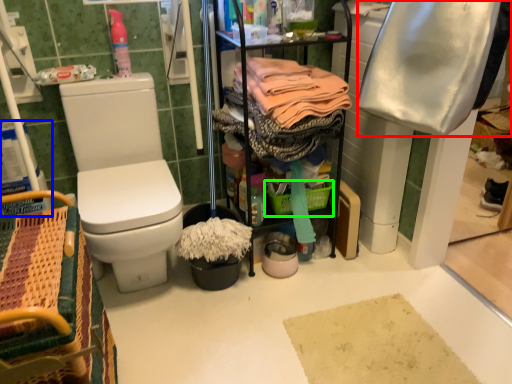
Question: Estimate the real-world distances between objects in this image. Which object is closer to clothing (highlighted by a red box), toilet paper (highlighted by a blue box) or basket (highlighted by a green box)?

Choices:
 (A) toilet paper
 (B) basket

Answer: (B)